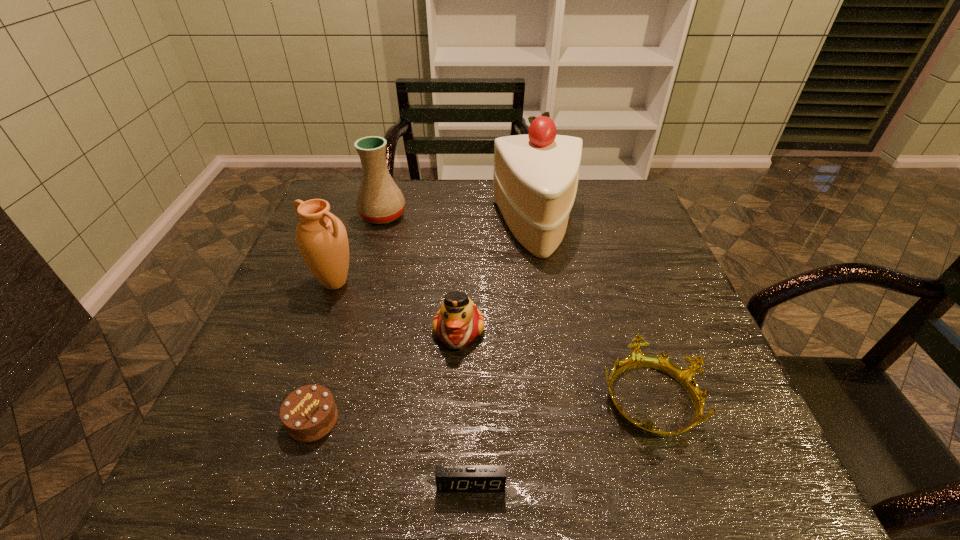
Identify which object is located as the third nearest to the fourth shortest object. Please provide its 2D coordinates. Your answer should be formatted as a tuple, i.e. [(x, y)], where the tuple contains the x and y coordinates of a point satisfying the conditions above.

[(321, 237)]

Locate an element on the screen. object that stands as the fifth closest to the chocolate cake is located at coordinates (536, 175).

Locate an element on the screen. vacant region that satisfies the following two spatial constraints: 1. on the front side of the pottery; 2. on the left side of the cake is located at coordinates (379, 228).